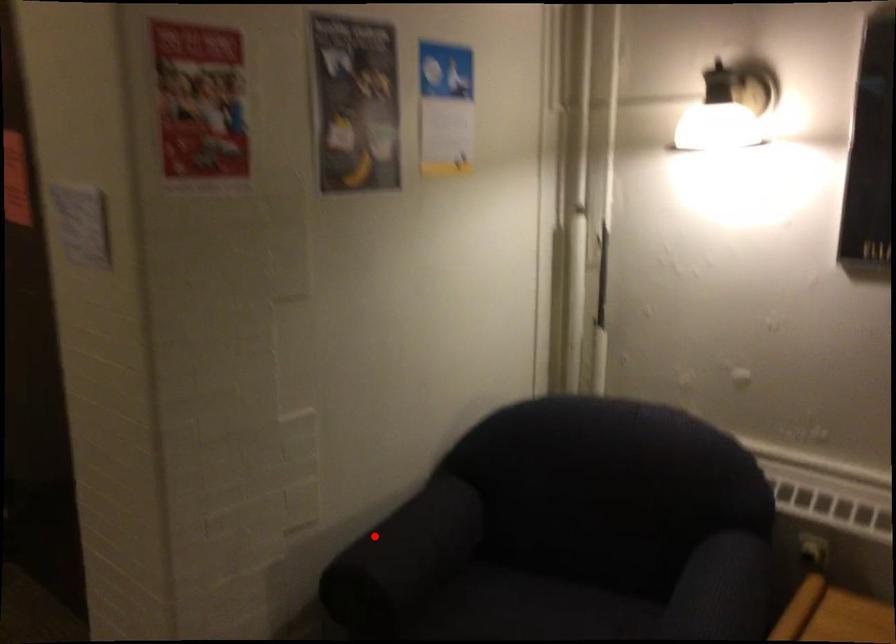
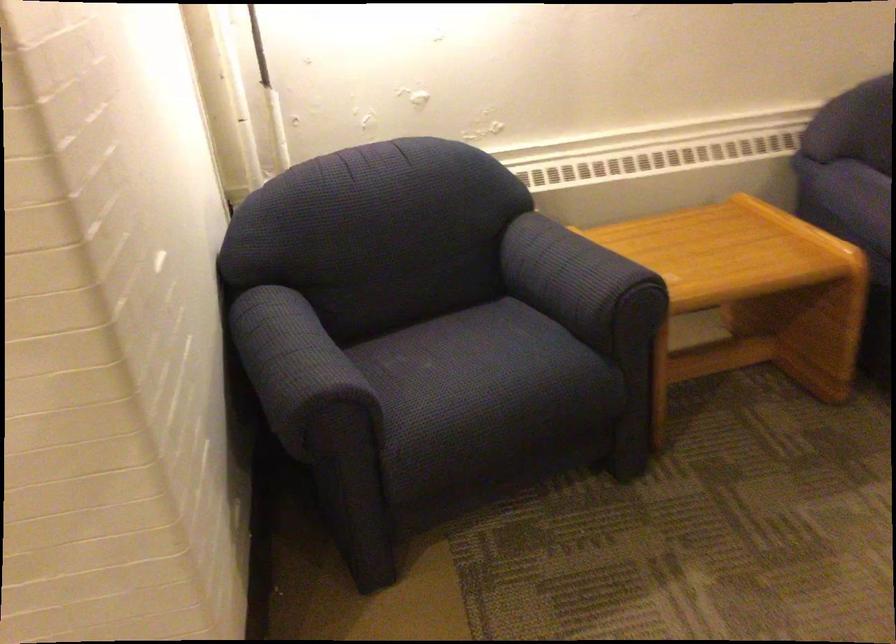
The point at the highlighted location is marked in the first image. Where is the corresponding point in the second image?

(294, 363)